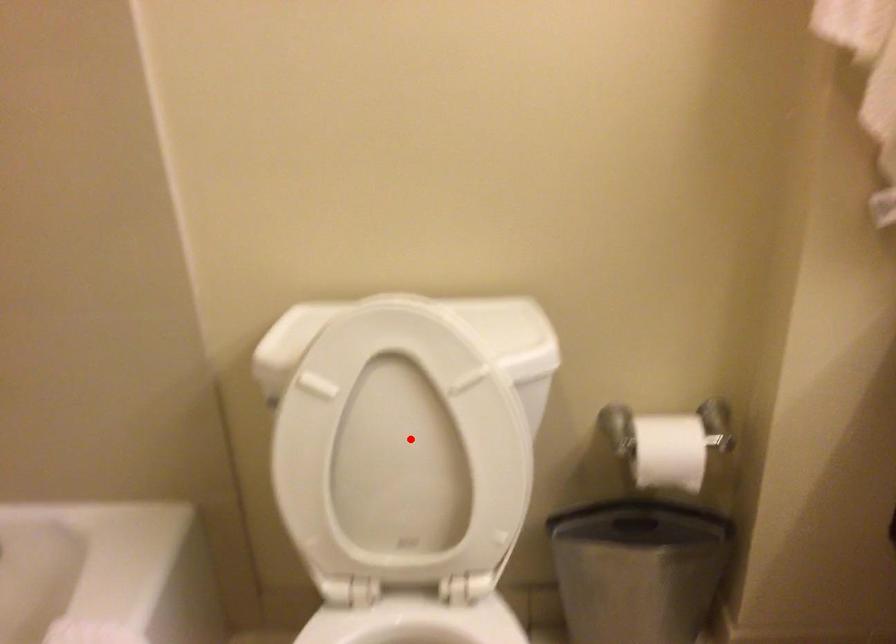
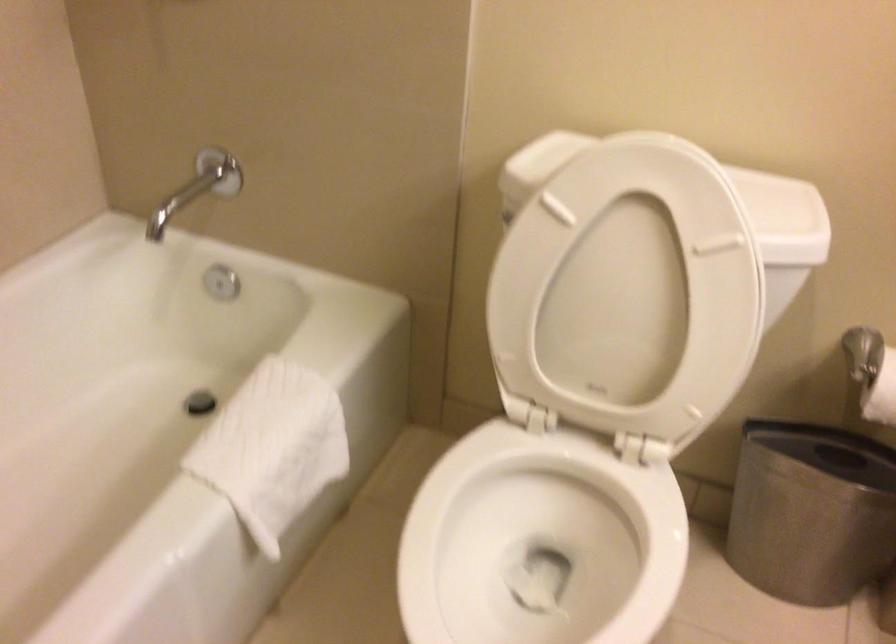
The point at the highlighted location is marked in the first image. Where is the corresponding point in the second image?

(633, 285)